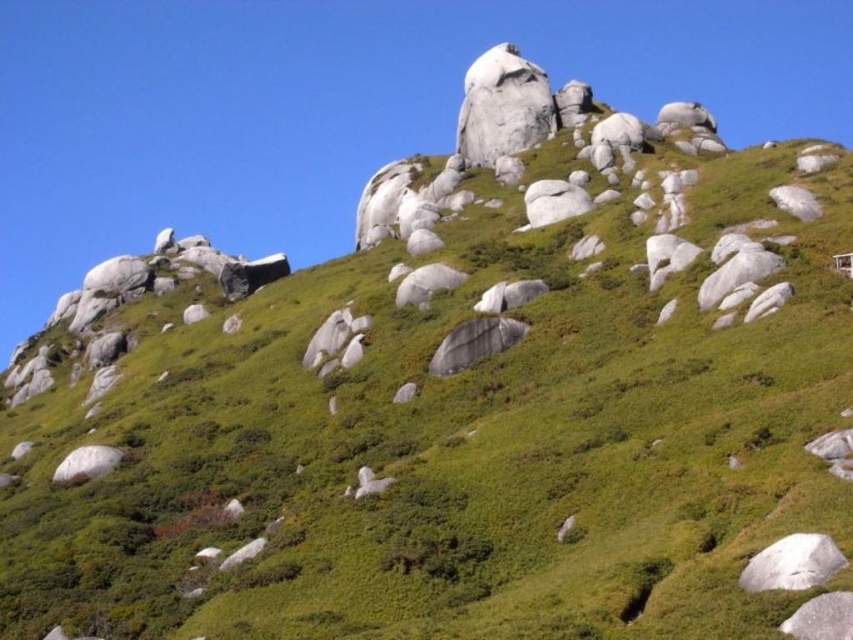
Which of these two, smooth gray rock at lower right or white smooth rock at lower left, stands shorter?

white smooth rock at lower left

Is smooth gray rock at lower right closer to the viewer compared to white smooth rock at lower left?

Yes, it is in front of white smooth rock at lower left.

Is point (801, 620) less distant than point (91, 477)?

Yes, point (801, 620) is closer to viewer.

The width and height of the screenshot is (853, 640). Identify the location of smooth gray rock at lower right. (821, 618).

Consider the image. Can you confirm if white smooth rock at center is positioned to the left of white smooth rock at lower left?

Incorrect, white smooth rock at center is not on the left side of white smooth rock at lower left.

Who is more distant from viewer, (538, 180) or (80, 452)?

Positioned behind is point (538, 180).

Measure the distance between point (531, 204) and camera.

A distance of 111.49 meters exists between point (531, 204) and camera.

At what (x,y) coordinates should I click in order to perform the action: click on white smooth rock at center. Please return your answer as a coordinate pair (x, y). This screenshot has width=853, height=640. Looking at the image, I should click on (553, 202).

Which is below, white smooth rock at lower right or smooth gray rock at lower right?

smooth gray rock at lower right is below.

Based on the photo, is white smooth rock at lower right above smooth gray rock at lower right?

Correct, white smooth rock at lower right is located above smooth gray rock at lower right.

What do you see at coordinates (792, 563) in the screenshot?
I see `white smooth rock at lower right` at bounding box center [792, 563].

You are a GUI agent. You are given a task and a screenshot of the screen. Output one action in this format:
    pyautogui.click(x=<x>, y=<y>)
    Task: Click on the white smooth rock at lower right
    
    Given the screenshot: What is the action you would take?
    pyautogui.click(x=792, y=563)